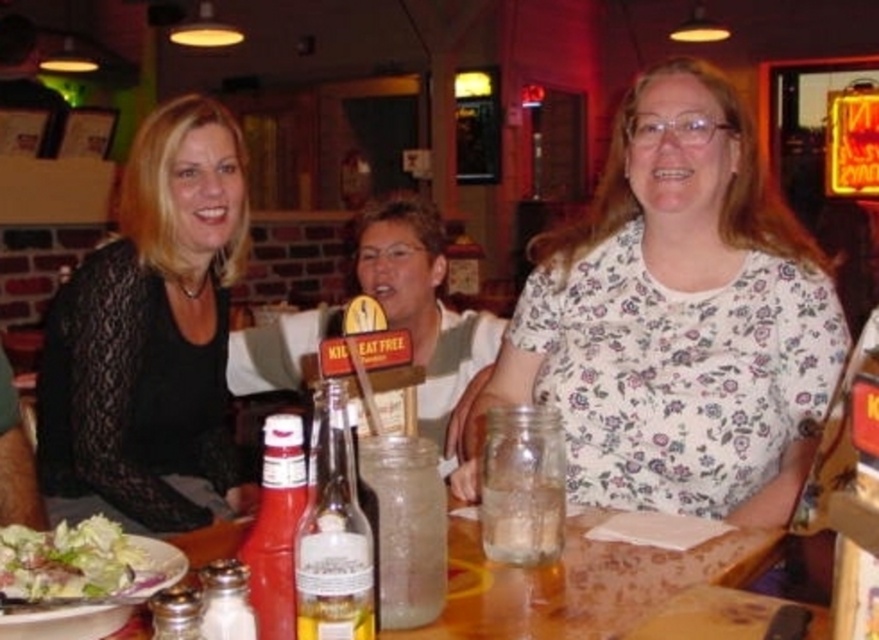
Question: Does black lace top at left appear on the right side of wooden table at center?

Choices:
 (A) yes
 (B) no

Answer: (B)

Question: Which point is closer to the camera?

Choices:
 (A) floral cotton shirt at center
 (B) black lace top at left
 (C) green leafy salad at lower left

Answer: (C)

Question: Which point is closer to the camera?

Choices:
 (A) floral cotton shirt at center
 (B) wooden table at center

Answer: (B)

Question: Does floral cotton shirt at center have a smaller size compared to green leafy salad at lower left?

Choices:
 (A) yes
 (B) no

Answer: (B)

Question: Does floral cotton shirt at center appear over wooden table at center?

Choices:
 (A) no
 (B) yes

Answer: (B)

Question: Which of the following is the farthest from the observer?

Choices:
 (A) floral cotton shirt at center
 (B) green leafy salad at lower left

Answer: (A)